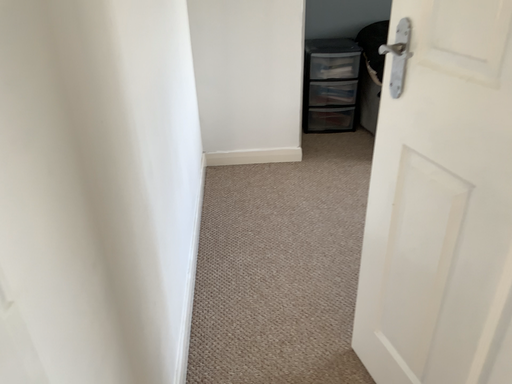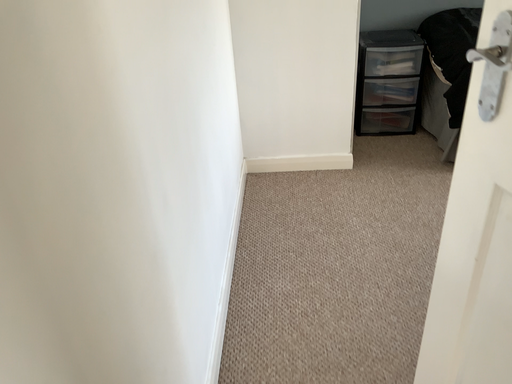
Question: Which way did the camera rotate in the video?

Choices:
 (A) rotated right
 (B) rotated left

Answer: (B)